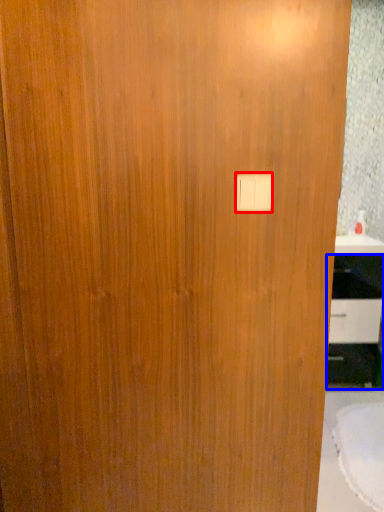
Question: Which point is further to the camera, light switch (highlighted by a red box) or cabinetry (highlighted by a blue box)?

Choices:
 (A) light switch
 (B) cabinetry

Answer: (B)